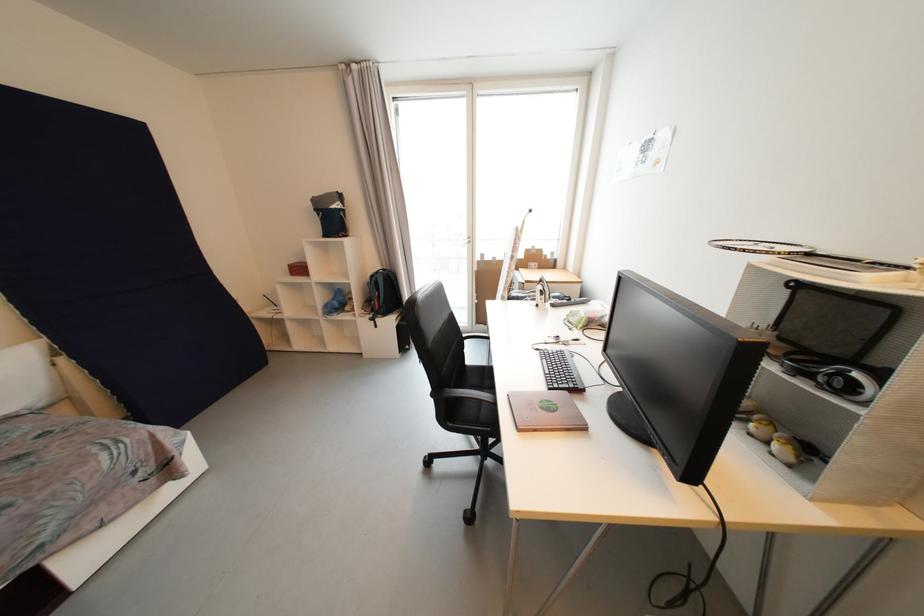
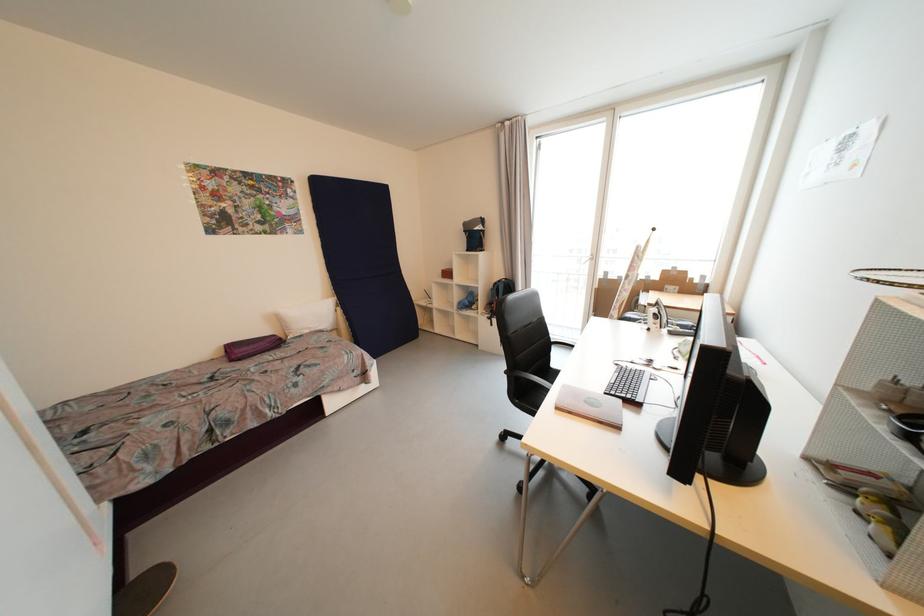
The point at (378,278) is marked in the first image. Where is the corresponding point in the second image?

(501, 285)